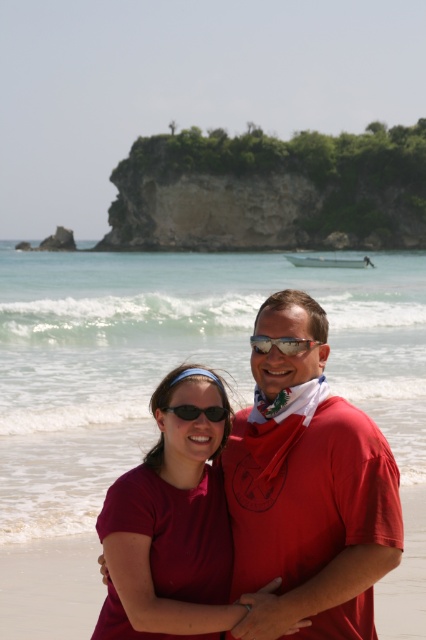
You are a photographer taking a picture of the matte red shirt at center and the black plastic sunglasses at center. Which object should you adjust to ensure both are centered in the frame?

The matte red shirt at center is to the left of the black plastic sunglasses at center. To center both in the frame, you should move the matte red shirt at center slightly to the right so it aligns with the black plastic sunglasses at center.